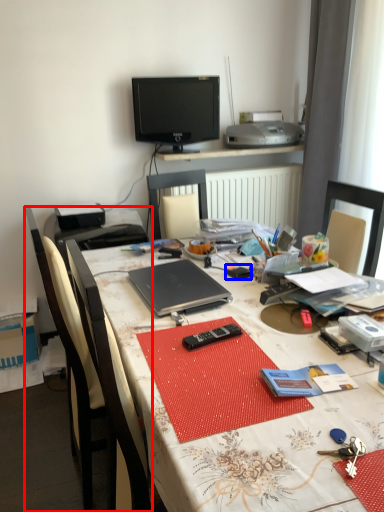
Question: Which point is further to the camera, chair (highlighted by a red box) or stationery (highlighted by a blue box)?

Choices:
 (A) chair
 (B) stationery

Answer: (B)